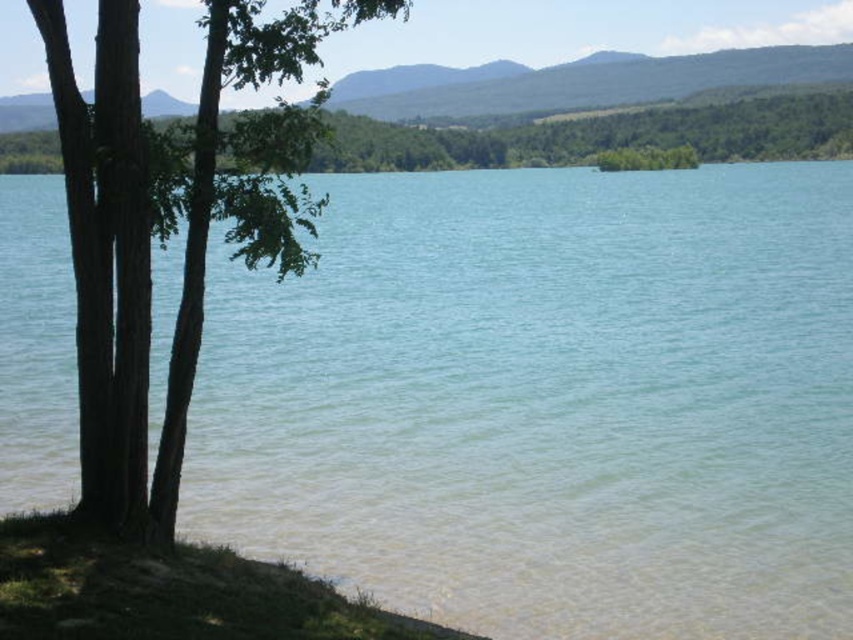
You are standing at the lakeside and want to take a photo of both the brown rough bark tree at left and the green leafy tree at upper left. Which tree should you move closer to in order to capture both in the frame?

Since the brown rough bark tree at left is smaller than the green leafy tree at upper left, you should move closer to the brown rough bark tree at left to ensure both trees fit within the camera frame.

You are standing at the lakeside and want to take a photo of both the brown rough bark tree at left and the green leafy tree at upper left. Which tree should you focus on first to ensure both are in clear view?

You should focus on the brown rough bark tree at left first because it is closer to you than the green leafy tree at upper left, so adjusting focus from near to far will help capture both clearly.